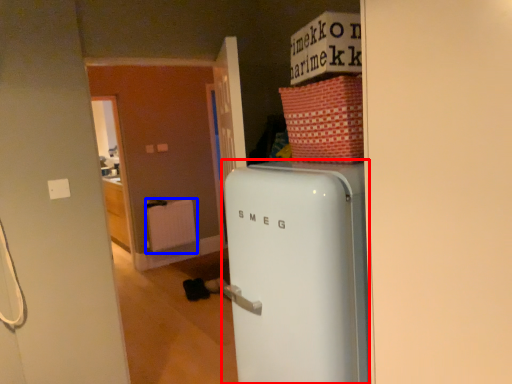
Question: Among these objects, which one is farthest to the camera, refrigerator (highlighted by a red box) or radiator (highlighted by a blue box)?

Choices:
 (A) refrigerator
 (B) radiator

Answer: (B)